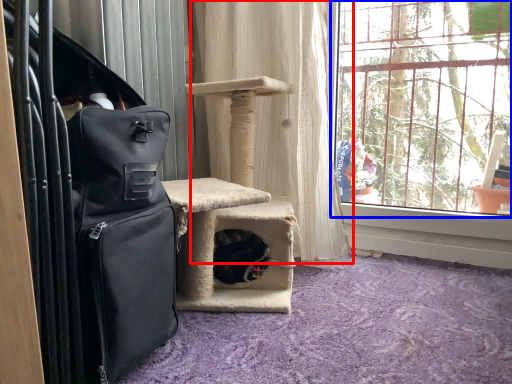
Question: Which object appears closest to the camera in this image, curtain (highlighted by a red box) or window (highlighted by a blue box)?

Choices:
 (A) curtain
 (B) window

Answer: (B)